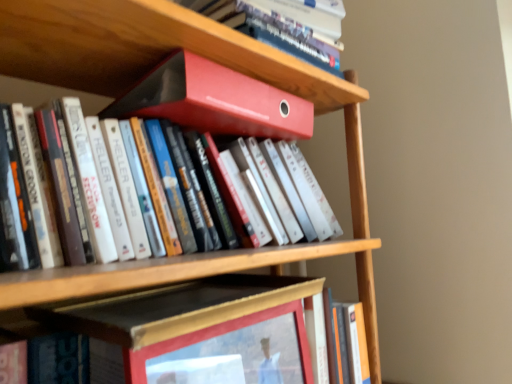
Question: Should I look upward or downward to see matte red binder at upper center, arranged as the second book when viewed from the top?

Choices:
 (A) down
 (B) up

Answer: (B)

Question: Is matte plastic file at upper center with wooden picture frame at center?

Choices:
 (A) no
 (B) yes

Answer: (A)

Question: Is matte plastic file at upper center far away from wooden picture frame at center?

Choices:
 (A) yes
 (B) no

Answer: (B)

Question: Considering the relative sizes of matte plastic file at upper center and wooden picture frame at center in the image provided, is matte plastic file at upper center smaller than wooden picture frame at center?

Choices:
 (A) no
 (B) yes

Answer: (A)

Question: Is matte plastic file at upper center bigger than wooden picture frame at center?

Choices:
 (A) no
 (B) yes

Answer: (B)

Question: From the image's perspective, is matte plastic file at upper center beneath wooden picture frame at center?

Choices:
 (A) yes
 (B) no

Answer: (B)

Question: From a real-world perspective, does matte plastic file at upper center sit lower than wooden picture frame at center?

Choices:
 (A) yes
 (B) no

Answer: (B)

Question: From a real-world perspective, is matte plastic file at upper center below matte red binder at upper center, arranged as the second book when viewed from the top?

Choices:
 (A) no
 (B) yes

Answer: (A)

Question: Would you say matte red binder at upper center, the 4th book positioned from the bottom, is part of matte plastic file at upper center's contents?

Choices:
 (A) yes
 (B) no

Answer: (B)

Question: Is matte plastic file at upper center not within matte red binder at upper center, the 4th book positioned from the bottom?

Choices:
 (A) no
 (B) yes

Answer: (B)

Question: Is matte plastic file at upper center positioned before matte red binder at upper center, arranged as the second book when viewed from the top?

Choices:
 (A) no
 (B) yes

Answer: (A)

Question: Is matte plastic file at upper center not close to matte red binder at upper center, arranged as the second book when viewed from the top?

Choices:
 (A) yes
 (B) no

Answer: (B)

Question: Can you confirm if matte plastic file at upper center is taller than matte red binder at upper center, the 4th book positioned from the bottom?

Choices:
 (A) yes
 (B) no

Answer: (A)

Question: Does orange matte book at lower right, which ranks as the first book in bottom-to-top order, have a lesser width compared to wooden picture frame at center?

Choices:
 (A) no
 (B) yes

Answer: (A)